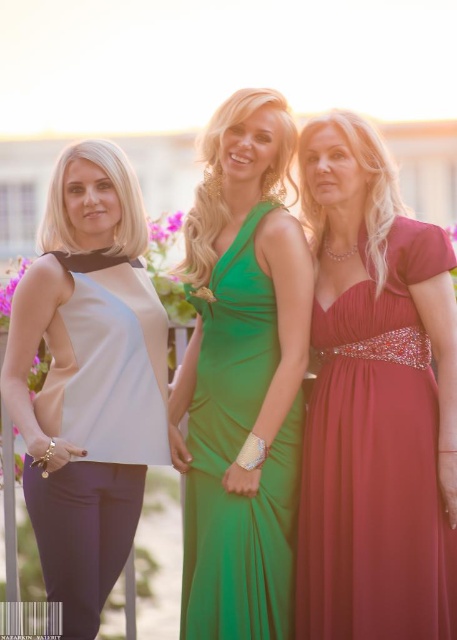
Based on the scene description, which clothing item is positioned higher between the shiny burgundy dress at right and the matte white blouse at left?

The shiny burgundy dress at right is positioned higher than the matte white blouse at left according to the description.

Looking at this image, you are standing in front of the three women in the image. You want to know which of the two points, point (160, 340) or point (287, 474), is closer to you. Which one is closer?

Point (160, 340) is closer to you because it is further to the viewer than point (287, 474).

You are a photographer trying to decide which subject to focus on. Given that the shiny burgundy dress at right and the matte white blouse at left are in the frame, which one would appear more prominent due to its size?

The shiny burgundy dress at right is larger in size than the matte white blouse at left, so it would appear more prominent.